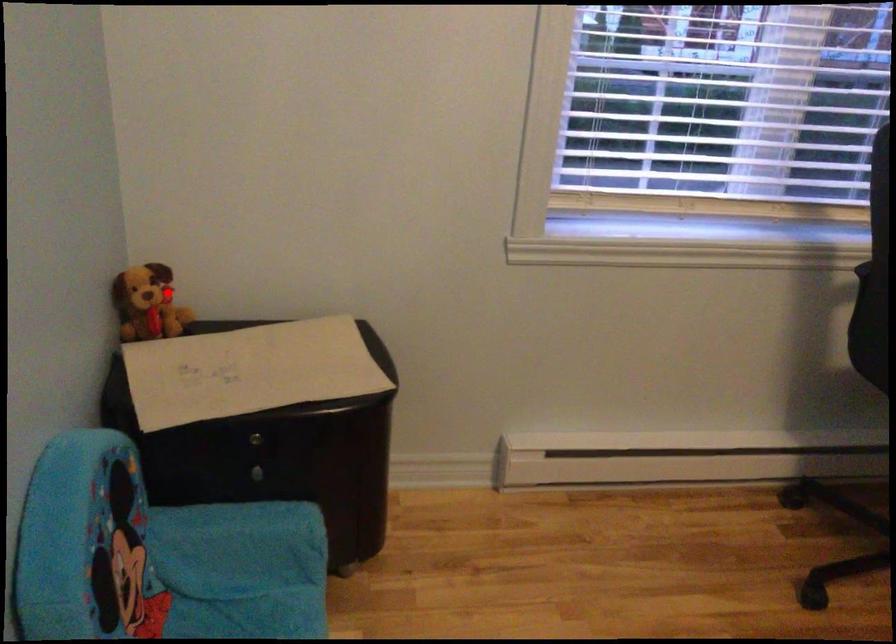
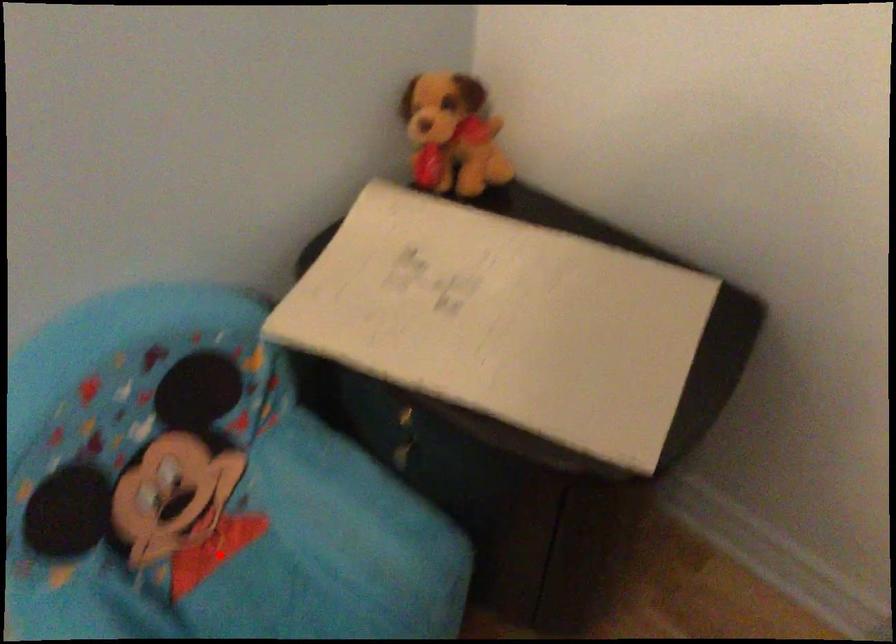
I am providing you with two images of the same scene from different viewpoints. A red point is marked on the first image and another point is marked on the second image. Is the red point in image1 aligned with the point shown in image2?

No